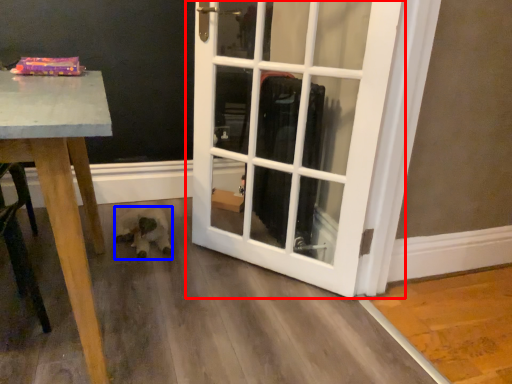
Question: Among these objects, which one is farthest to the camera, door (highlighted by a red box) or animal (highlighted by a blue box)?

Choices:
 (A) door
 (B) animal

Answer: (B)